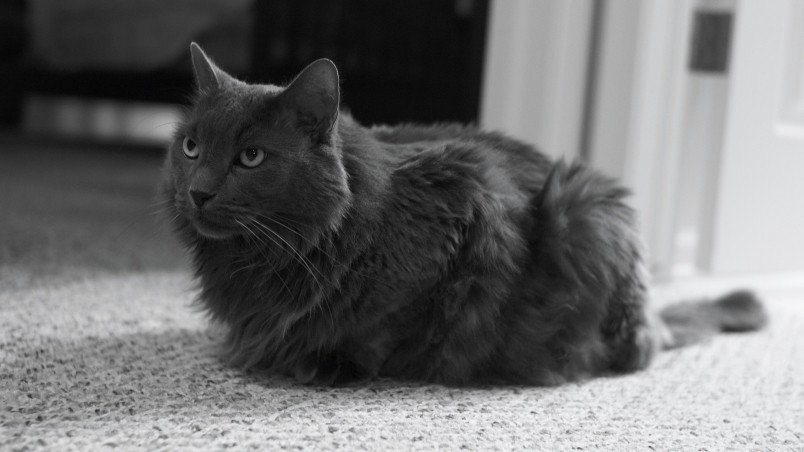
This screenshot has width=804, height=452. In order to click on floor in this screenshot , I will do pos(453,415).